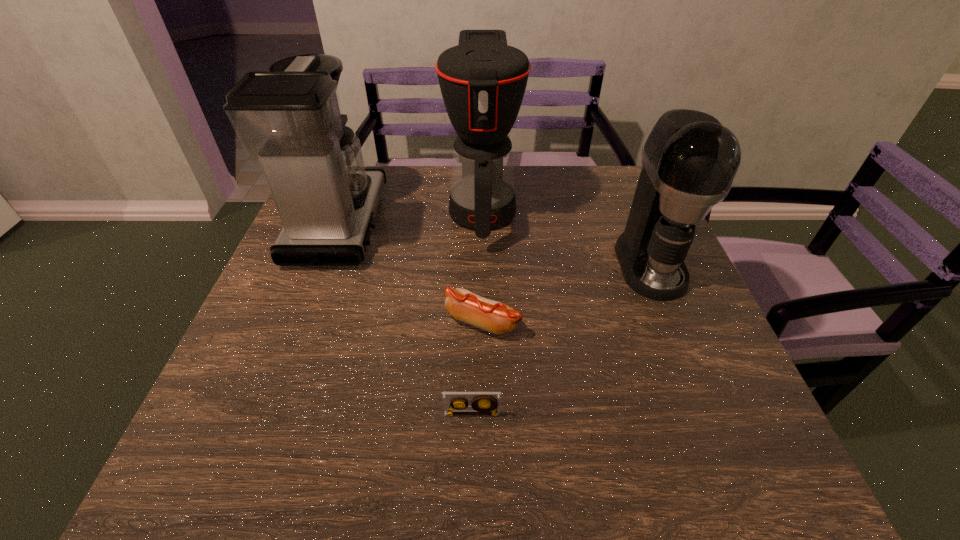
Identify the location of the second coffee maker from left to right. Image resolution: width=960 pixels, height=540 pixels. (482, 80).

I want to click on the leftmost coffee maker, so click(x=289, y=118).

Find the location of a particular element. The image size is (960, 540). the rightmost coffee maker is located at coordinates (689, 160).

Where is `the fourth farthest object`? the fourth farthest object is located at coordinates (496, 317).

Identify the location of videotape. (454, 403).

This screenshot has width=960, height=540. I want to click on vacant space positioned 0.390m pour from the carafe of the second coffee maker from left to right, so click(484, 395).

You are a GUI agent. You are given a task and a screenshot of the screen. Output one action in this format:
    pyautogui.click(x=<x>, y=<y>)
    Task: Click on the free space located 0.220m at the front of the leftmost coffee maker where the controls are located
    The width and height of the screenshot is (960, 540).
    Given the screenshot: What is the action you would take?
    pyautogui.click(x=464, y=223)

You are a GUI agent. You are given a task and a screenshot of the screen. Output one action in this format:
    pyautogui.click(x=<x>, y=<y>)
    Task: Click on the vacant space located place cup under the spout of the rightmost object
    
    Given the screenshot: What is the action you would take?
    pyautogui.click(x=672, y=319)

The image size is (960, 540). I want to click on free region located on the left of the fourth farthest object, so point(373,322).

You are a GUI agent. You are given a task and a screenshot of the screen. Output one action in this format:
    pyautogui.click(x=<x>, y=<y>)
    Task: Click on the vacant region located 0.060m at the front of the videotape with visible reels
    This screenshot has width=960, height=540.
    Given the screenshot: What is the action you would take?
    [471, 450]